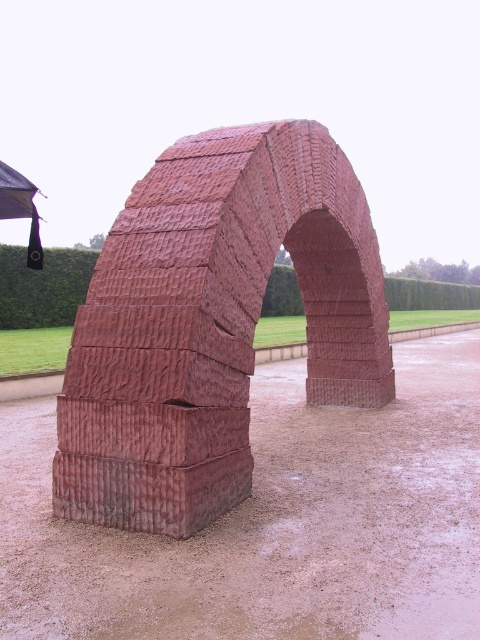
You are standing in a garden and see the rustic stone arch at center and the black fabric umbrella at upper left. Which object is positioned to the left of the other?

The black fabric umbrella at upper left is positioned to the left of the rustic stone arch at center.

You are standing in front of the stone archway sculpture. There are two points marked on the archway. One is at coordinate point (157, 259) and the other is at point (20, 179). Which point is closer to your current position?

Point (157, 259) is closer to the camera than point (20, 179), so the point at coordinate (157, 259) is closer to your current position.

You are standing in a garden and want to place a new decorative item between the rustic stone arch at center and the black fabric umbrella at upper left. Considering their widths, which object should you position closer to the narrower side of the space?

The rustic stone arch at center is thinner than the black fabric umbrella at upper left, so you should position the rustic stone arch at center closer to the narrower side of the space.